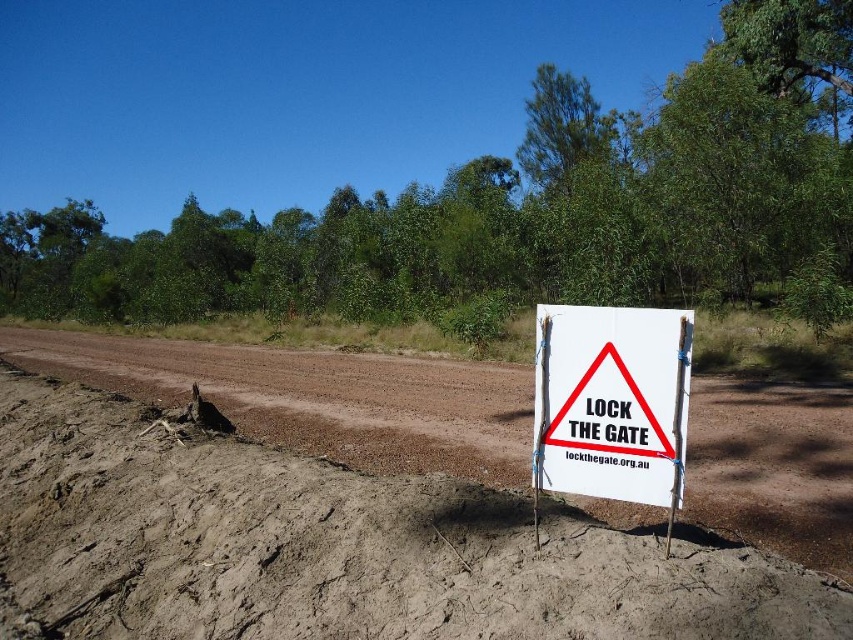
Question: Among these objects, which one is farthest from the camera?

Choices:
 (A) white paper sign at center
 (B) brown dirt at center

Answer: (A)

Question: Among these points, which one is nearest to the camera?

Choices:
 (A) (469, 588)
 (B) (630, 388)

Answer: (A)

Question: Is brown dirt at center in front of white paper sign at center?

Choices:
 (A) no
 (B) yes

Answer: (B)

Question: Can you confirm if brown dirt at center is positioned below white paper sign at center?

Choices:
 (A) yes
 (B) no

Answer: (A)

Question: Does brown dirt at center have a smaller size compared to white paper sign at center?

Choices:
 (A) no
 (B) yes

Answer: (A)